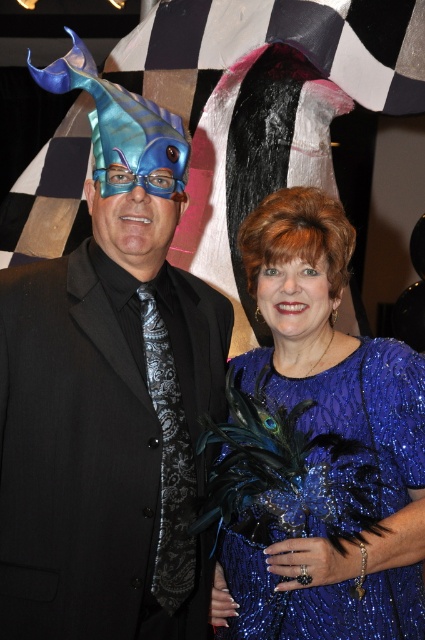
Question: Which object is the farthest from the blue glossy goggles at center?

Choices:
 (A) matte black suit at center
 (B) sparkly blue dress at center

Answer: (B)

Question: Considering the relative positions of sparkly blue dress at center and blue glossy goggles at center in the image provided, where is sparkly blue dress at center located with respect to blue glossy goggles at center?

Choices:
 (A) below
 (B) above

Answer: (A)

Question: Among these points, which one is farthest from the camera?

Choices:
 (A) (376, 620)
 (B) (102, 182)
 (C) (27, 611)

Answer: (B)

Question: Which object is the closest to the matte black suit at center?

Choices:
 (A) blue glossy goggles at center
 (B) sparkly blue dress at center

Answer: (B)

Question: Can you confirm if matte black suit at center is positioned below blue glossy goggles at center?

Choices:
 (A) yes
 (B) no

Answer: (A)

Question: Does sparkly blue dress at center have a larger size compared to blue glossy goggles at center?

Choices:
 (A) no
 (B) yes

Answer: (B)